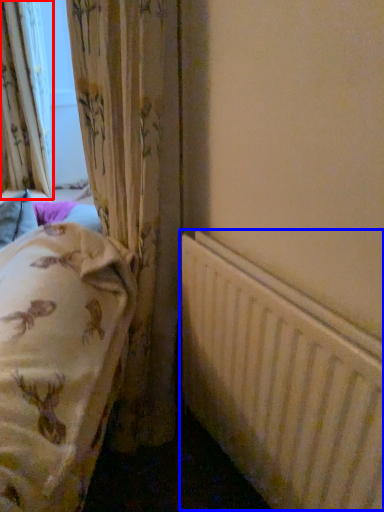
Question: Which of the following is the farthest to the observer, curtain (highlighted by a red box) or radiator (highlighted by a blue box)?

Choices:
 (A) curtain
 (B) radiator

Answer: (A)